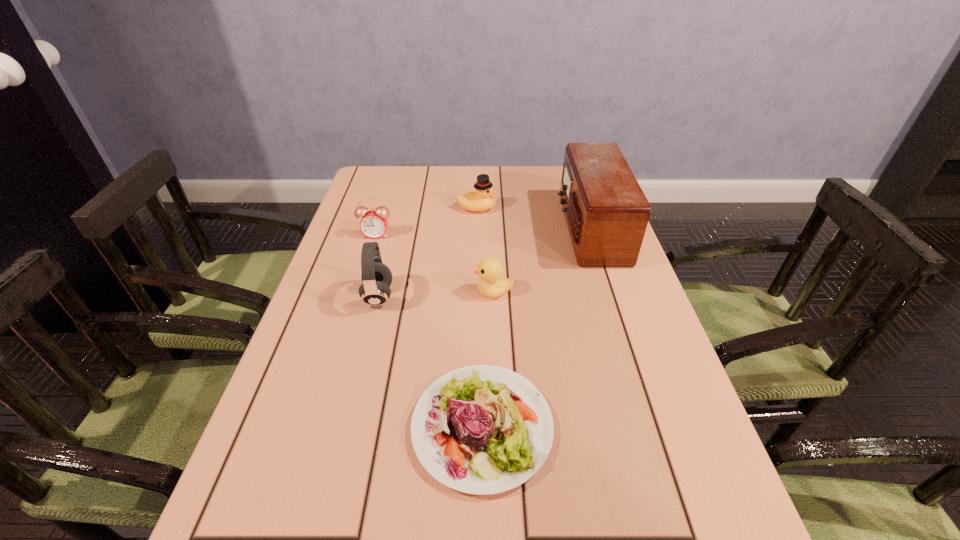
The width and height of the screenshot is (960, 540). Find the location of `free space in the image that satisfies the following two spatial constraints: 1. on the ear cups of the shortest object; 2. on the left side of the fifth shortest object`. free space in the image that satisfies the following two spatial constraints: 1. on the ear cups of the shortest object; 2. on the left side of the fifth shortest object is located at coordinates (346, 427).